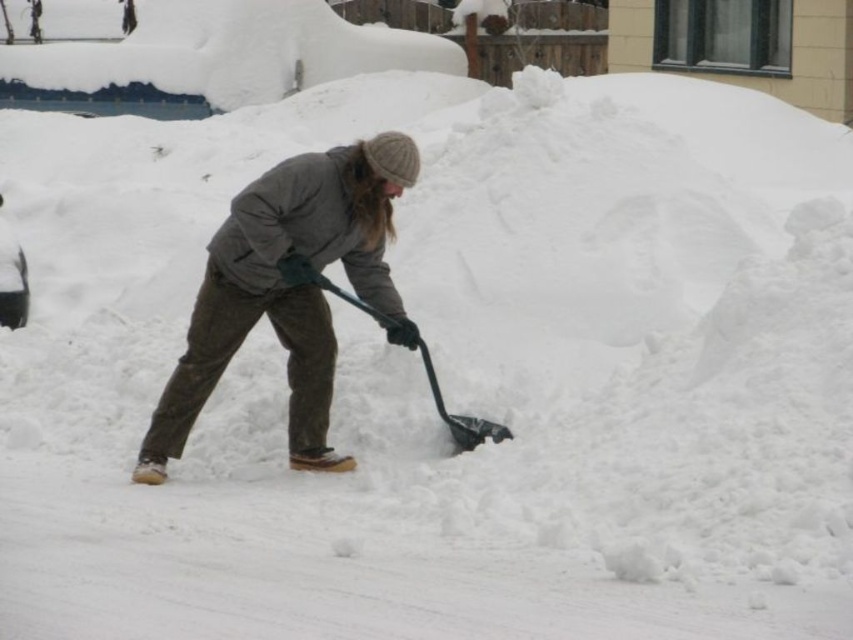
Is dark gray woolen jacket at center taller than black plastic shovel at center?

Correct, dark gray woolen jacket at center is much taller as black plastic shovel at center.

Is point (399, 186) positioned behind point (430, 381)?

No.

This screenshot has width=853, height=640. Find the location of `dark gray woolen jacket at center`. dark gray woolen jacket at center is located at coordinates (289, 289).